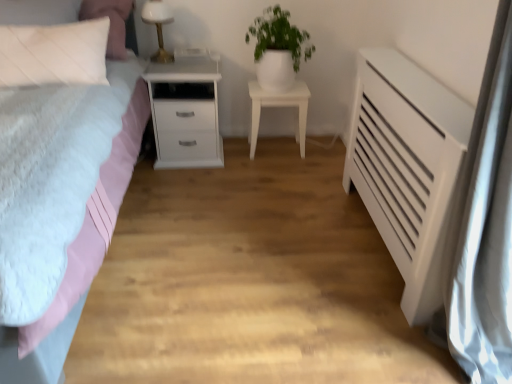
Where is `vacant space that's between white matte radiator at right and white matte nightstand at left, marked as the 1th nightstand in a left-to-right arrangement`? This screenshot has width=512, height=384. vacant space that's between white matte radiator at right and white matte nightstand at left, marked as the 1th nightstand in a left-to-right arrangement is located at coordinates (281, 223).